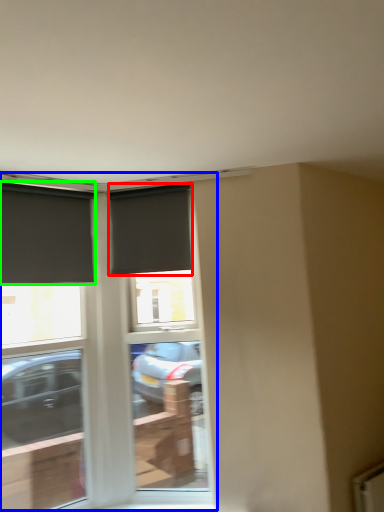
Question: Estimate the real-world distances between objects in this image. Which object is closer to window (highlighted by a red box), window (highlighted by a blue box) or window (highlighted by a green box)?

Choices:
 (A) window
 (B) window

Answer: (B)